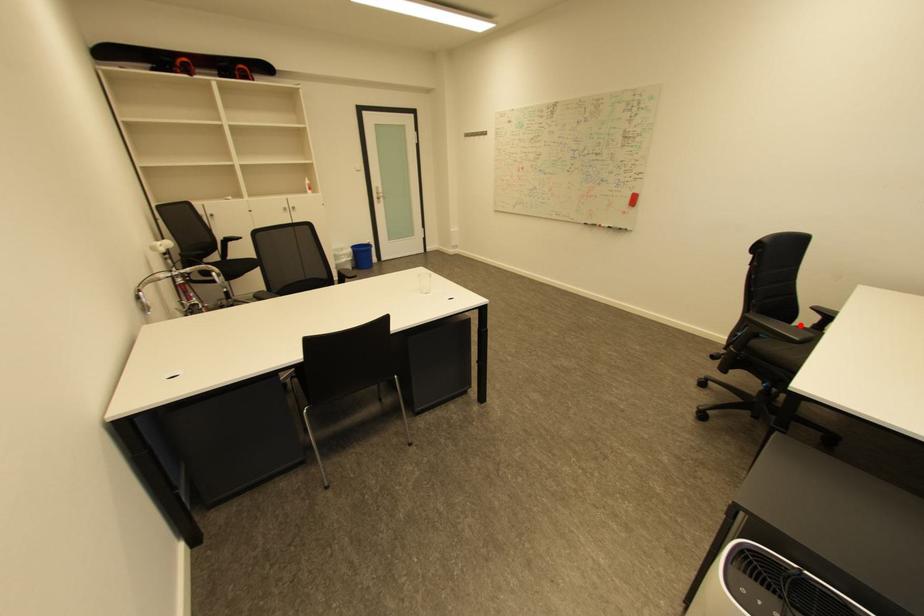
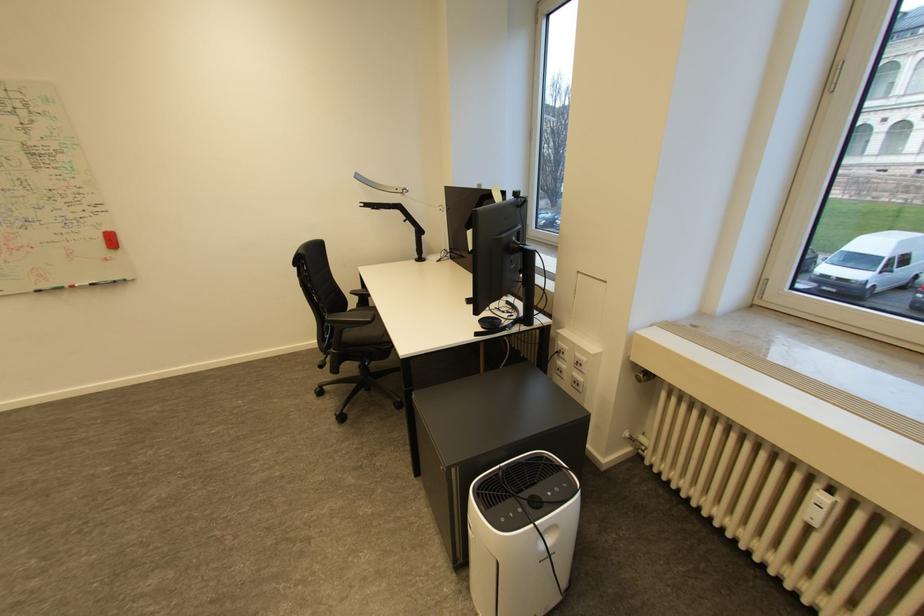
The point at the highlighted location is marked in the first image. Where is the corresponding point in the second image?

(355, 310)